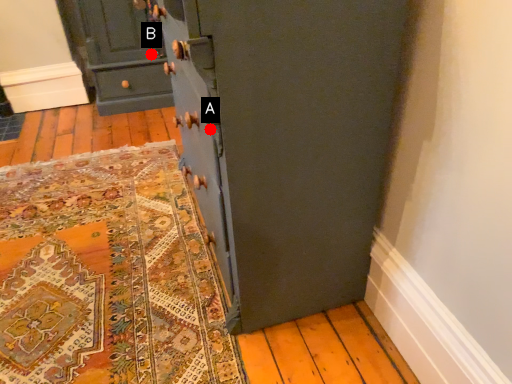
Question: Two points are circled on the image, labeled by A and B beside each circle. Which point is closer to the camera?

Choices:
 (A) A is closer
 (B) B is closer

Answer: (A)